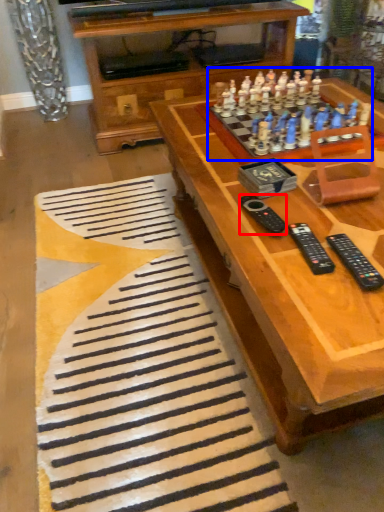
Question: Which point is further to the camera, remote (highlighted by a red box) or game (highlighted by a blue box)?

Choices:
 (A) remote
 (B) game

Answer: (B)